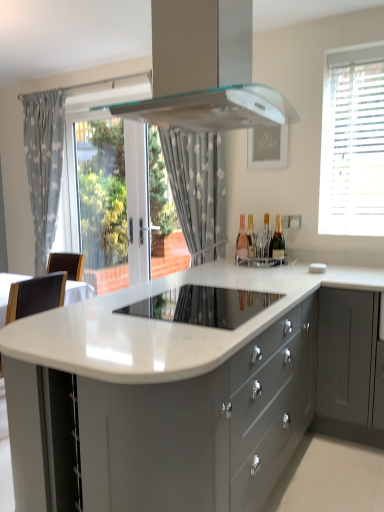
Question: Considering the relative sizes of high-gloss white cooktop at center and white blinds at upper right in the image provided, is high-gloss white cooktop at center smaller than white blinds at upper right?

Choices:
 (A) yes
 (B) no

Answer: (A)

Question: Is high-gloss white cooktop at center not within white blinds at upper right?

Choices:
 (A) no
 (B) yes

Answer: (B)

Question: From the image's perspective, does high-gloss white cooktop at center appear lower than white blinds at upper right?

Choices:
 (A) yes
 (B) no

Answer: (A)

Question: Could you tell me if high-gloss white cooktop at center is turned towards white blinds at upper right?

Choices:
 (A) yes
 (B) no

Answer: (B)

Question: Is high-gloss white cooktop at center positioned with its back to white blinds at upper right?

Choices:
 (A) no
 (B) yes

Answer: (A)

Question: From a real-world perspective, does high-gloss white cooktop at center stand above white blinds at upper right?

Choices:
 (A) no
 (B) yes

Answer: (A)

Question: Can you confirm if white dotted fabric at center, which ranks as the 1th curtain in front-to-back order, is smaller than satin silver range hood at upper center?

Choices:
 (A) yes
 (B) no

Answer: (A)

Question: Is white dotted fabric at center, which ranks as the 2th curtain in left-to-right order, taller than satin silver range hood at upper center?

Choices:
 (A) yes
 (B) no

Answer: (A)

Question: Considering the relative positions of white dotted fabric at center, which is the 2th curtain from back to front, and satin silver range hood at upper center in the image provided, is white dotted fabric at center, which is the 2th curtain from back to front, to the right of satin silver range hood at upper center from the viewer's perspective?

Choices:
 (A) no
 (B) yes

Answer: (A)

Question: Considering the relative positions of white dotted fabric at center, placed as the 1th curtain when sorted from right to left, and satin silver range hood at upper center in the image provided, is white dotted fabric at center, placed as the 1th curtain when sorted from right to left, to the left of satin silver range hood at upper center from the viewer's perspective?

Choices:
 (A) yes
 (B) no

Answer: (A)

Question: Does white dotted fabric at center, which ranks as the 2th curtain in left-to-right order, have a lesser width compared to satin silver range hood at upper center?

Choices:
 (A) no
 (B) yes

Answer: (B)

Question: From a real-world perspective, does white dotted fabric at center, which ranks as the 2th curtain in left-to-right order, sit lower than satin silver range hood at upper center?

Choices:
 (A) no
 (B) yes

Answer: (B)

Question: Can you confirm if black leather chair at left is positioned to the right of high-gloss white cooktop at center?

Choices:
 (A) no
 (B) yes

Answer: (A)